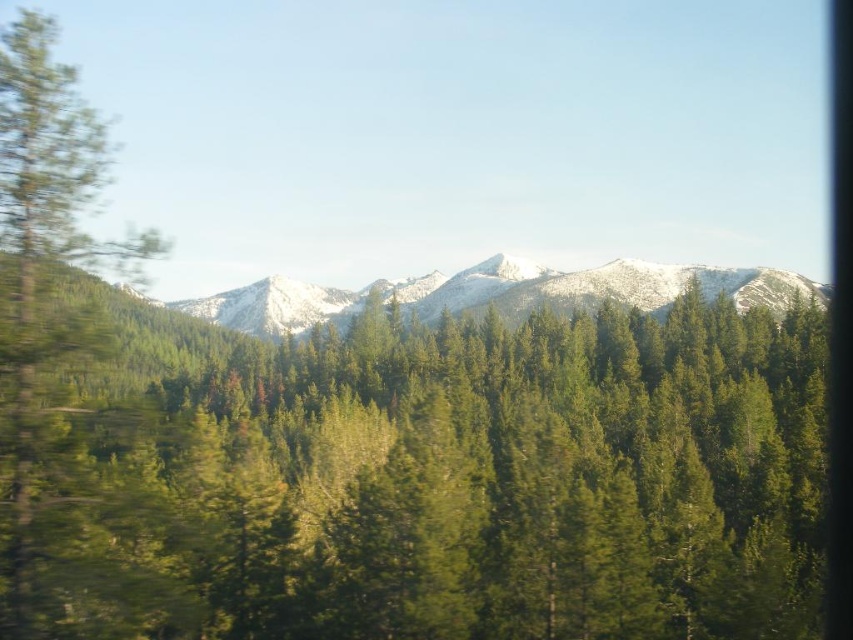
Question: Does green matte tree at left have a greater width compared to snowy mountain range at center?

Choices:
 (A) yes
 (B) no

Answer: (B)

Question: Which of the following is the farthest from the observer?

Choices:
 (A) green matte tree at left
 (B) snowy mountain range at center

Answer: (B)

Question: Can you confirm if green matte tree at left is wider than snowy mountain range at center?

Choices:
 (A) yes
 (B) no

Answer: (B)

Question: Among these points, which one is nearest to the camera?

Choices:
 (A) (26, 180)
 (B) (219, 301)

Answer: (A)

Question: Which object is closer to the camera taking this photo?

Choices:
 (A) green matte tree at left
 (B) snowy mountain range at center

Answer: (A)

Question: Can you confirm if green matte tree at left is positioned above snowy mountain range at center?

Choices:
 (A) no
 (B) yes

Answer: (A)